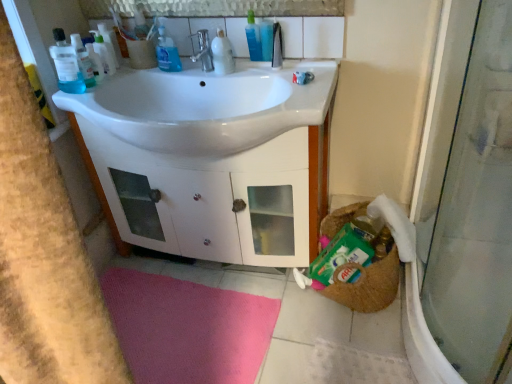
Question: Is satin nickel faucet at center further to the viewer compared to translucent plastic bottle at upper center?

Choices:
 (A) yes
 (B) no

Answer: (B)

Question: Does satin nickel faucet at center turn towards translucent plastic bottle at upper center?

Choices:
 (A) no
 (B) yes

Answer: (A)

Question: Is satin nickel faucet at center wider than translucent plastic bottle at upper center?

Choices:
 (A) no
 (B) yes

Answer: (B)

Question: Is satin nickel faucet at center facing away from translucent plastic bottle at upper center?

Choices:
 (A) no
 (B) yes

Answer: (A)

Question: Considering the relative sizes of satin nickel faucet at center and translucent plastic bottle at upper center in the image provided, is satin nickel faucet at center thinner than translucent plastic bottle at upper center?

Choices:
 (A) yes
 (B) no

Answer: (B)

Question: Based on their positions, is translucent plastic bottle at upper center located to the left or right of white glossy bottle at upper center, placed as the 1th cleaning product when sorted from right to left?

Choices:
 (A) left
 (B) right

Answer: (B)

Question: In the image, is translucent plastic bottle at upper center positioned in front of or behind white glossy bottle at upper center, placed as the 1th cleaning product when sorted from right to left?

Choices:
 (A) front
 (B) behind

Answer: (B)

Question: Considering the positions of translucent plastic bottle at upper center and white glossy bottle at upper center, placed as the 1th cleaning product when sorted from right to left, in the image, is translucent plastic bottle at upper center bigger or smaller than white glossy bottle at upper center, placed as the 1th cleaning product when sorted from right to left,?

Choices:
 (A) big
 (B) small

Answer: (B)

Question: Is point (253, 34) closer or farther from the camera than point (219, 72)?

Choices:
 (A) farther
 (B) closer

Answer: (A)

Question: In terms of size, does blue liquid soap at upper center, which is the 2th cleaning product from right to left, appear bigger or smaller than white glossy cabinet at center?

Choices:
 (A) small
 (B) big

Answer: (A)

Question: From a real-world perspective, is blue liquid soap at upper center, which is the 1th cleaning product from left to right, positioned above or below white glossy cabinet at center?

Choices:
 (A) above
 (B) below

Answer: (A)

Question: Is blue liquid soap at upper center, which is the 2th cleaning product from right to left, wider or thinner than white glossy cabinet at center?

Choices:
 (A) wide
 (B) thin

Answer: (B)

Question: From the image's perspective, is blue liquid soap at upper center, which is the 2th cleaning product from right to left, above or below white glossy cabinet at center?

Choices:
 (A) below
 (B) above

Answer: (B)

Question: Is blue liquid soap at upper center, which is the 2th cleaning product from right to left, situated inside white glossy sink at center or outside?

Choices:
 (A) inside
 (B) outside

Answer: (A)

Question: Looking at their shapes, would you say blue liquid soap at upper center, which is the 2th cleaning product from right to left, is wider or thinner than white glossy sink at center?

Choices:
 (A) thin
 (B) wide

Answer: (A)